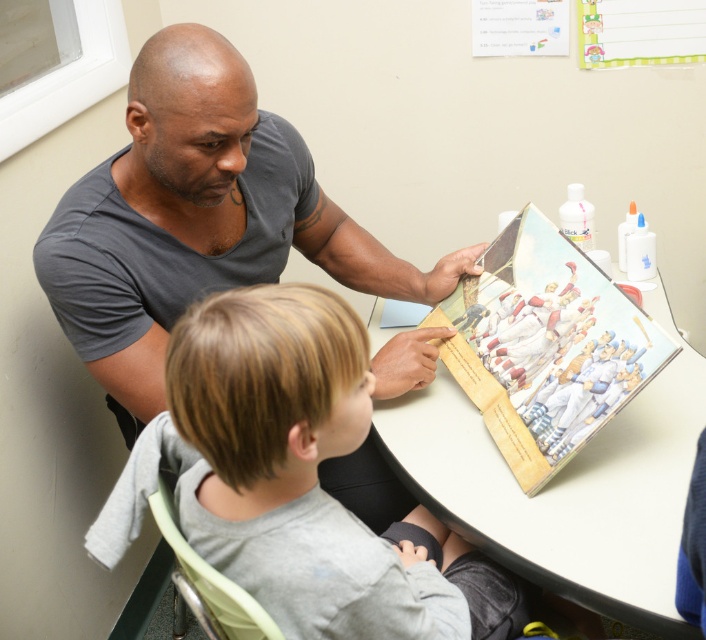
Identify the location of light brown hair at upper center. This screenshot has width=706, height=640. (309, 477).

This screenshot has height=640, width=706. Describe the element at coordinates (309, 477) in the screenshot. I see `light brown hair at upper center` at that location.

Is point (474, 618) more distant than point (522, 257)?

No, (474, 618) is in front of (522, 257).

Image resolution: width=706 pixels, height=640 pixels. Identify the location of light brown hair at upper center. (309, 477).

Is gray matte shirt at upper left smaller than white glossy table at center?

Indeed, gray matte shirt at upper left has a smaller size compared to white glossy table at center.

Can you confirm if gray matte shirt at upper left is bigger than white glossy table at center?

Actually, gray matte shirt at upper left might be smaller than white glossy table at center.

Does point (167, 140) come closer to viewer compared to point (683, 420)?

Yes, point (167, 140) is closer to viewer.

Where is `gray matte shirt at upper left`? The height and width of the screenshot is (640, 706). gray matte shirt at upper left is located at coordinates (197, 220).

Who is more forward, (68, 205) or (341, 522)?

Point (341, 522) is in front.

Can you confirm if gray matte shirt at upper left is thinner than light brown hair at upper center?

No, gray matte shirt at upper left is not thinner than light brown hair at upper center.

This screenshot has height=640, width=706. Describe the element at coordinates (197, 220) in the screenshot. I see `gray matte shirt at upper left` at that location.

Where is `gray matte shirt at upper left`? The height and width of the screenshot is (640, 706). gray matte shirt at upper left is located at coordinates (197, 220).